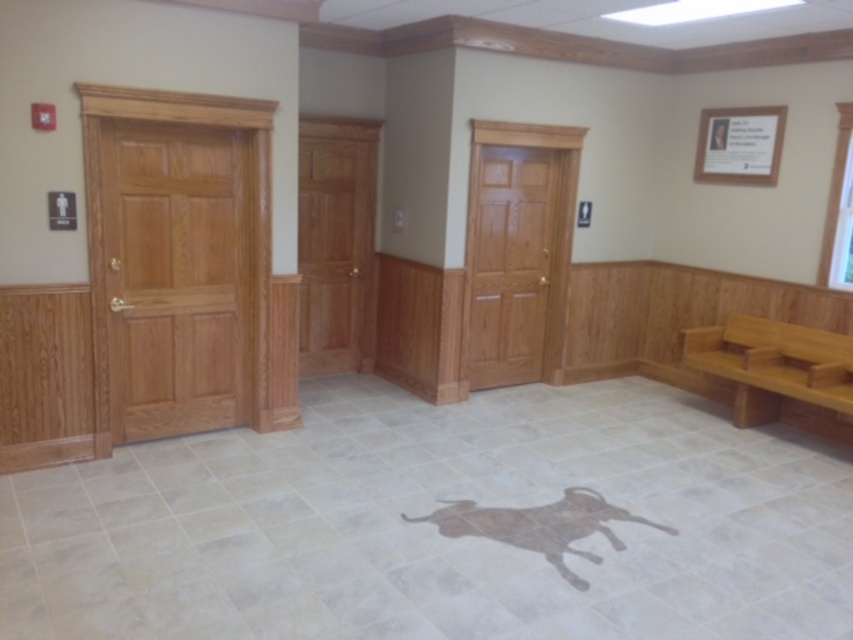
From the picture: Who is more distant from viewer, (502, 150) or (740, 417)?

Point (502, 150)

You are a GUI agent. You are given a task and a screenshot of the screen. Output one action in this format:
    pyautogui.click(x=<x>, y=<y>)
    Task: Click on the light oak wood door at center
    The width and height of the screenshot is (853, 640).
    Given the screenshot: What is the action you would take?
    pyautogui.click(x=509, y=260)

Does point (512, 236) come behind point (744, 371)?

Yes, point (512, 236) is farther from viewer.

At what (x,y) coordinates should I click in order to perform the action: click on light oak wood door at center. Please return your answer as a coordinate pair (x, y). Looking at the image, I should click on (509, 260).

This screenshot has height=640, width=853. In order to click on light brown wood door at left in this screenshot , I will do `click(177, 276)`.

Which is more to the right, light brown wood door at left or light oak wood door at center?

light oak wood door at center

Is point (138, 228) in front of point (537, 292)?

Yes, it is in front of point (537, 292).

Find the location of a particular element. The image size is (853, 640). light brown wood door at left is located at coordinates (177, 276).

Between light brown wood door at left and brown wooden bench at lower right, which one has more height?

light brown wood door at left

Which is in front, point (212, 205) or point (747, 410)?

Point (212, 205) is more forward.

Where is `light brown wood door at left`? light brown wood door at left is located at coordinates (177, 276).